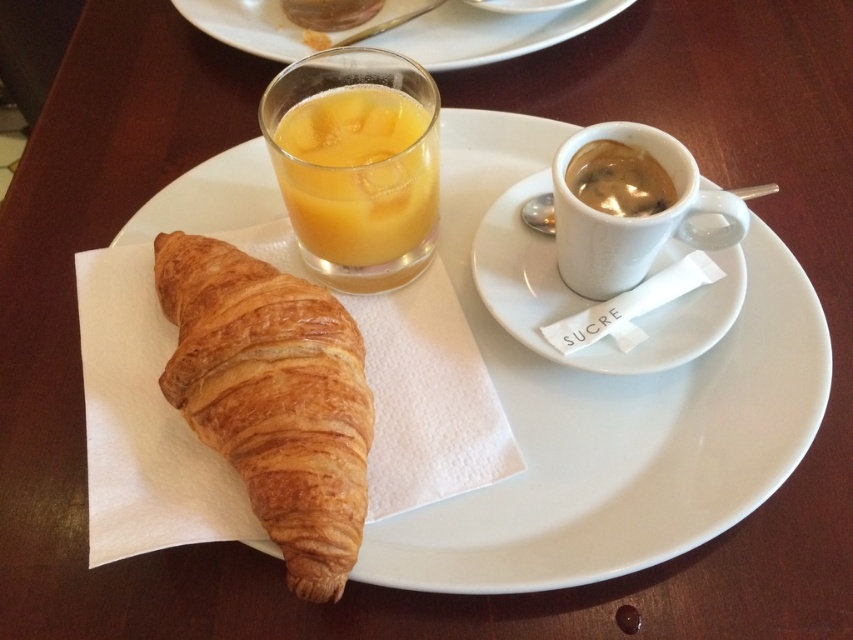
In the breakfast setting on the wooden table, there is a white ceramic saucer at upper center. What object is located at point (585, 298)?

The white ceramic saucer at upper center is located at point (585, 298).

You are setting up a table for a breakfast service and need to place a small spoon between the white ceramic saucer at upper center and the matte glass at upper center. Which object should the spoon be placed closer to if you want it to be higher off the table?

The spoon should be placed closer to the white ceramic saucer at upper center because it has a greater height compared to the matte glass at upper center, allowing the spoon to be positioned higher off the table.

You are a food critic standing at the edge of the table. You want to take a bite of the golden brown flaky croissant at left. Can you reach it without moving your body?

The golden brown flaky croissant at left is 14.12 inches away from camera, so yes, you can reach it without moving your body since the distance is within typical arm reach.